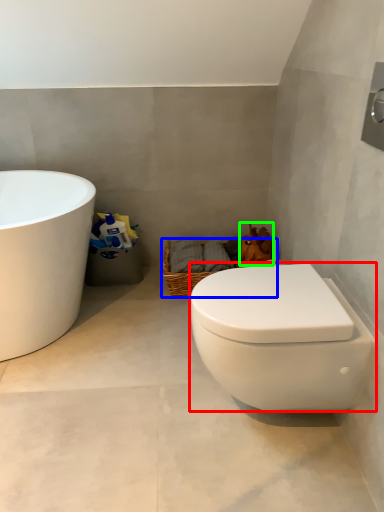
Question: Based on their relative distances, which object is farther from toilet (highlighted by a red box)? Choose from basket (highlighted by a blue box) and animal (highlighted by a green box).

Choices:
 (A) basket
 (B) animal

Answer: (B)